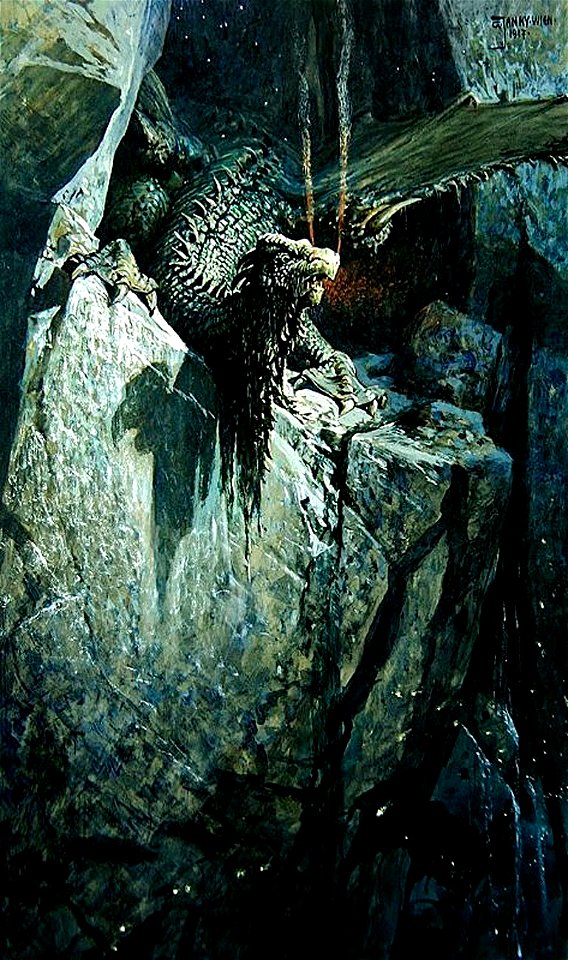
Where is `painting`? The height and width of the screenshot is (960, 568). painting is located at coordinates (237, 730).